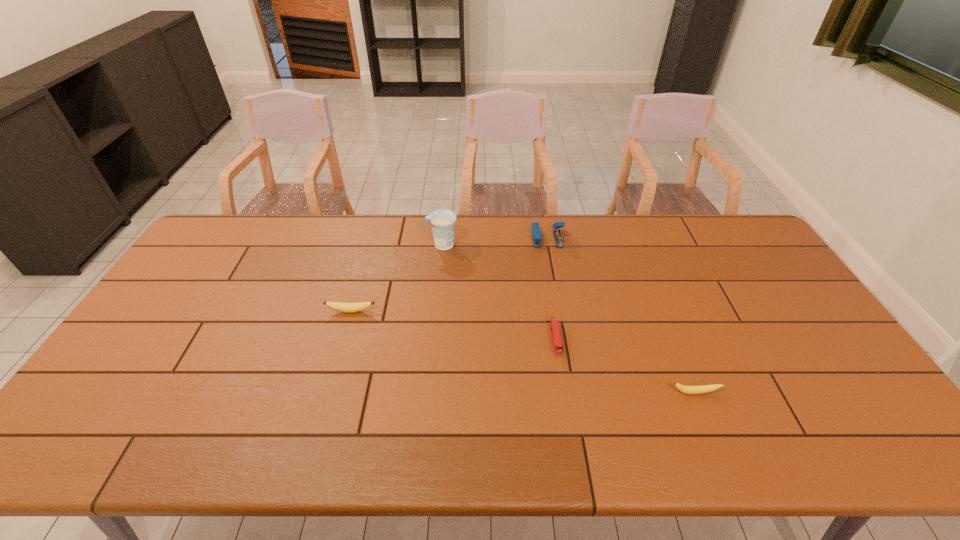
In order to click on free spot between the nearest object and the yogurt in this screenshot , I will do `click(568, 319)`.

Locate which object is the fourth closest to the nearest object. Please provide its 2D coordinates. Your answer should be formatted as a tuple, i.e. [(x, y)], where the tuple contains the x and y coordinates of a point satisfying the conditions above.

[(339, 306)]

Locate an element on the screen. This screenshot has height=540, width=960. object that ranks as the closest to the third nearest object is located at coordinates (442, 221).